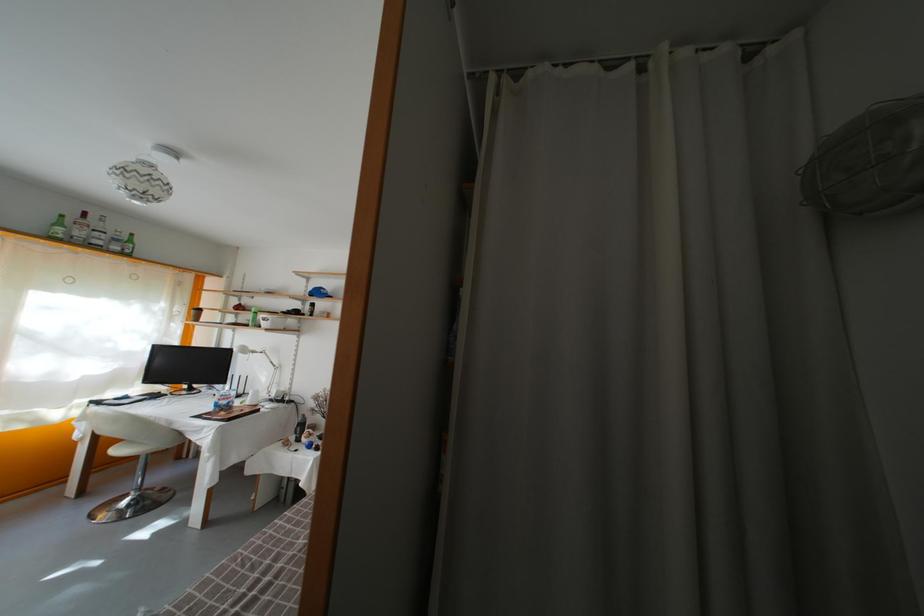
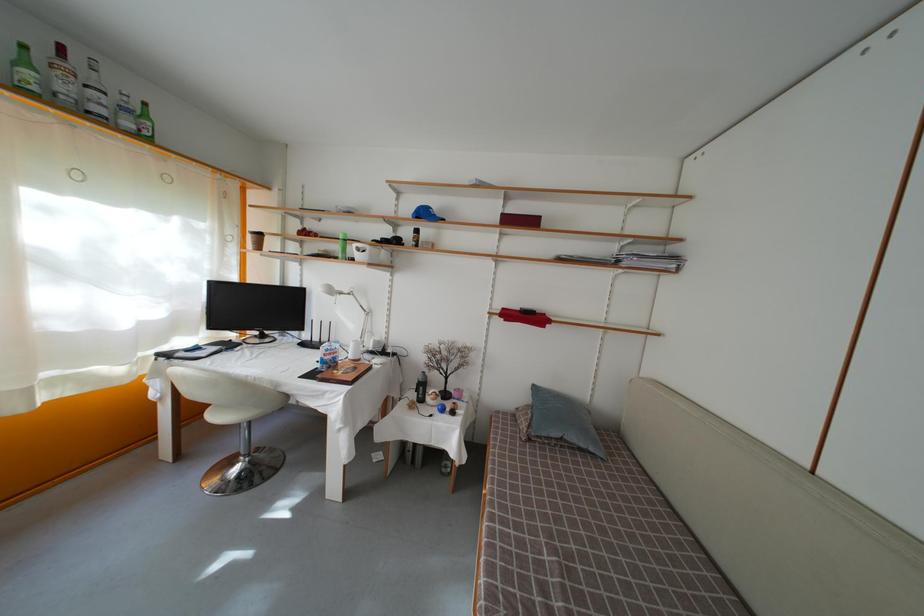
Where in the second image is the point corresponding to pixel 270 330 from the first image?

(363, 262)